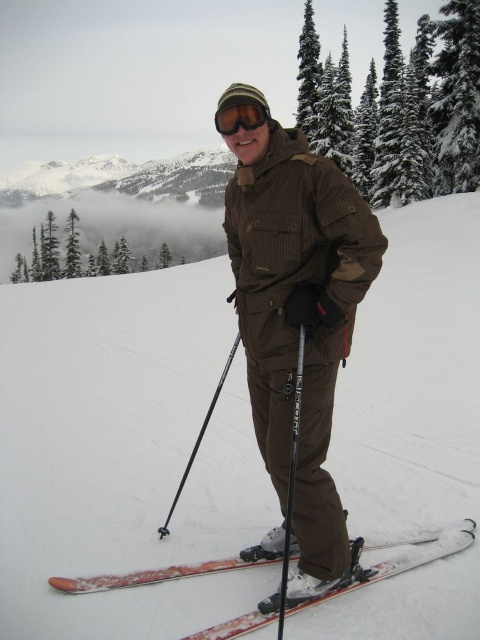
In the scene shown: You are a photographer trying to capture the person in the scene. You notice the matte black goggles at center and the black matte ski pole at center. Which object is located to the left of the other?

The matte black goggles at center is positioned on the left side of black matte ski pole at center, so the goggles are to the left of the ski pole.

You are a photographer planning to take a photo of the snowy slope scene. You want to ensure that the white powder snow at center is clearly visible in the photo. Where should you position your camera relative to the point marked as point (124, 452)?

The point (124, 452) indicates the location of the white powder snow at center. To capture it clearly, position the camera directly facing this point to ensure the white powder snow at center is centered in the frame.